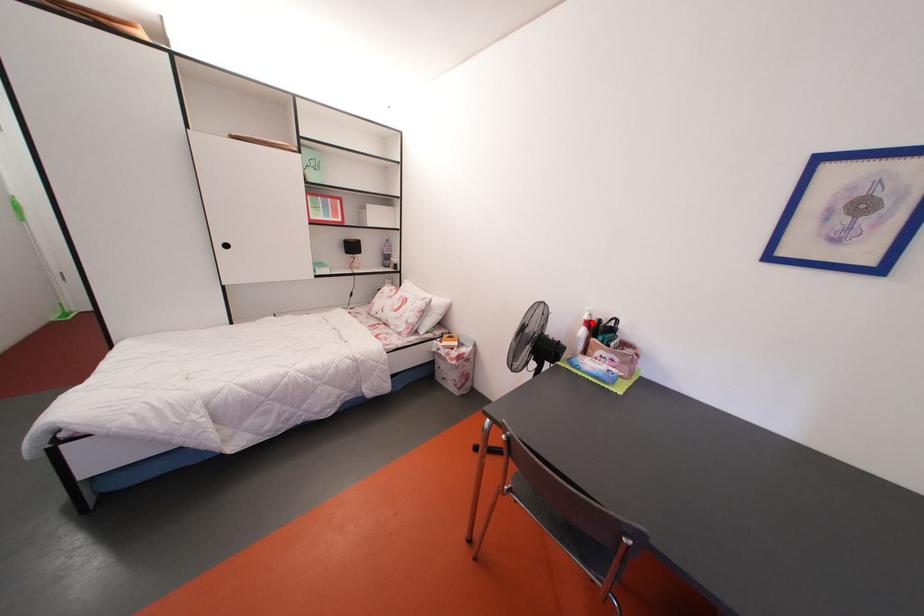
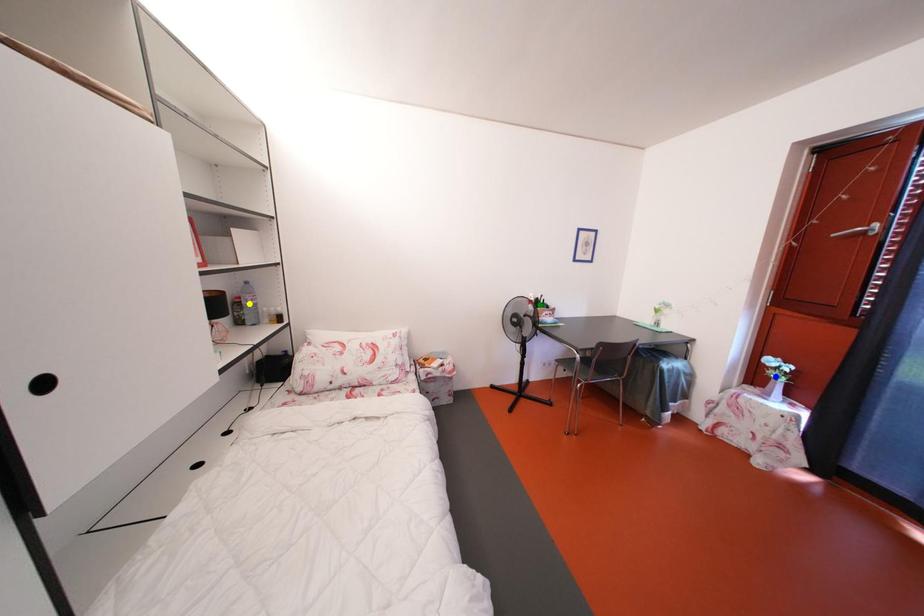
Question: I am providing you with two images of the same scene from different viewpoints. A red point is marked on the first image. You are given multiple points on the second image. In image 2, which mark is for the same physical point as the one in image 1?

Choices:
 (A) blue point
 (B) green point
 (C) yellow point

Answer: (B)